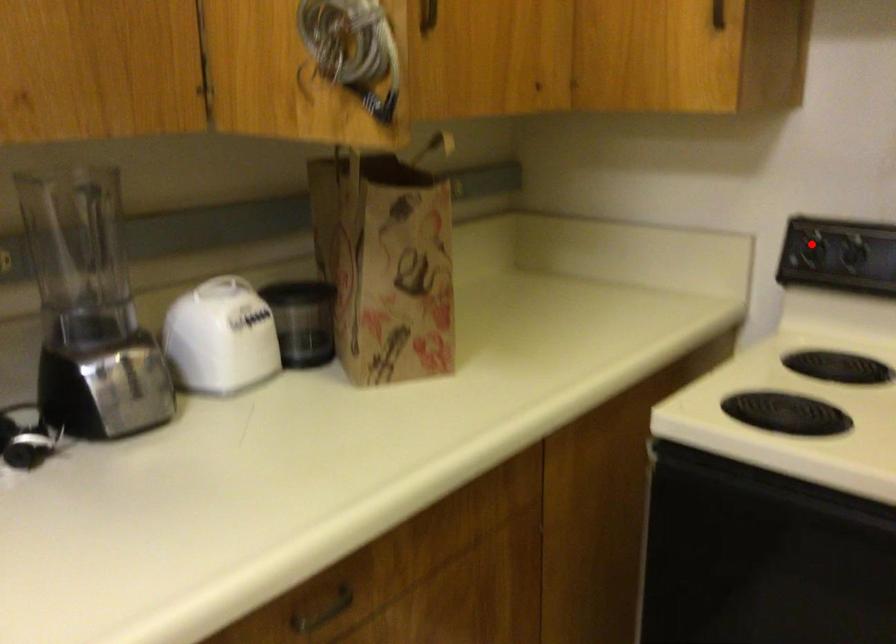
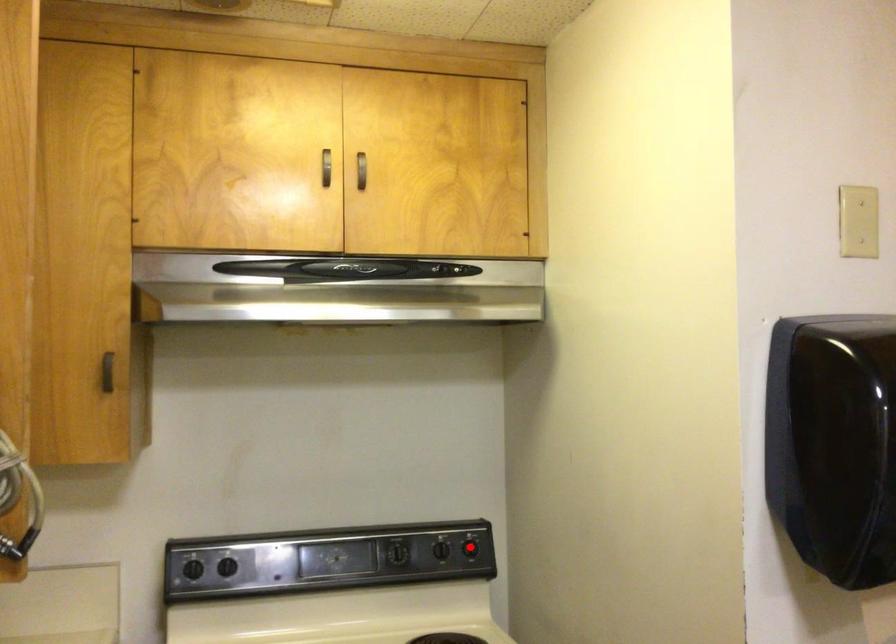
I am providing you with two images of the same scene from different viewpoints. A red point is marked on the first image and another point is marked on the second image. Is the red point in image1 aligned with the point shown in image2?

No